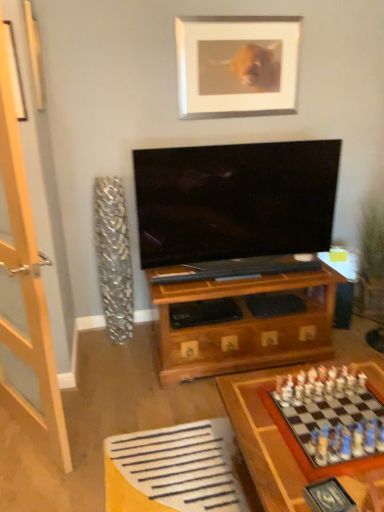
At what (x,y) coordinates should I click in order to perform the action: click on free point above wooden chess set at lower right (from a real-world perspective). Please return your answer as a coordinate pair (x, y). This screenshot has height=512, width=384. Looking at the image, I should click on (324, 410).